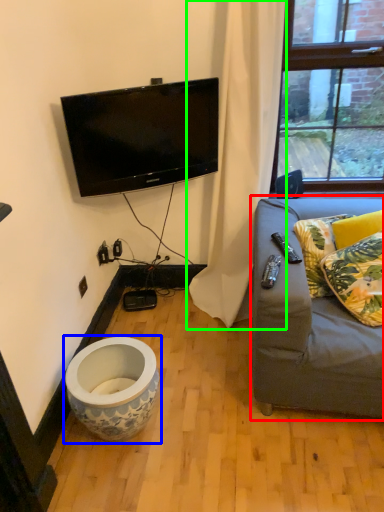
Question: Which is farther away from studio couch (highlighted by a red box)? toilet (highlighted by a blue box) or curtain (highlighted by a green box)?

Choices:
 (A) toilet
 (B) curtain

Answer: (A)